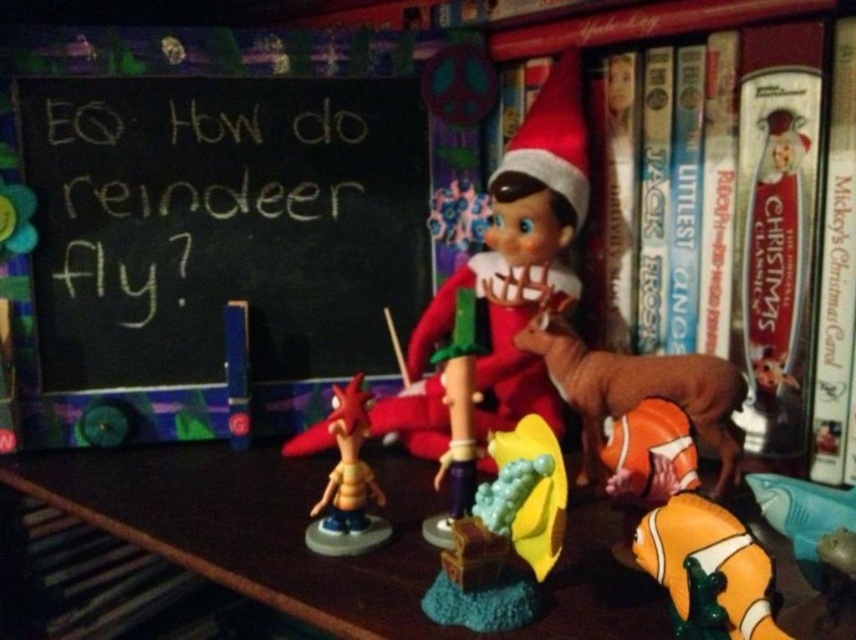
Question: Is black chalkboard at upper left thinner than brown matte reindeer at center-right?

Choices:
 (A) yes
 (B) no

Answer: (B)

Question: Which of the following is the farthest from the observer?

Choices:
 (A) (646, 109)
 (B) (440, 580)
 (C) (592, 412)
 (D) (596, 577)

Answer: (A)

Question: Which object is closer to the camera taking this photo?

Choices:
 (A) yellow rubber duck at center
 (B) black chalkboard at upper left
 (C) yellow rubber fish at lower right

Answer: (C)

Question: Observing the image, what is the correct spatial positioning of black chalkboard at upper left in reference to yellow rubber fish at lower right?

Choices:
 (A) below
 (B) above

Answer: (B)

Question: In this image, where is wooden bookshelf at upper right located relative to brown matte reindeer at center-right?

Choices:
 (A) below
 (B) above

Answer: (B)

Question: Estimate the real-world distances between objects in this image. Which object is farther from the brown matte reindeer at center-right?

Choices:
 (A) black chalkboard at upper left
 (B) wooden table at center
 (C) yellow rubber fish at lower right
 (D) yellow rubber duck at center

Answer: (A)